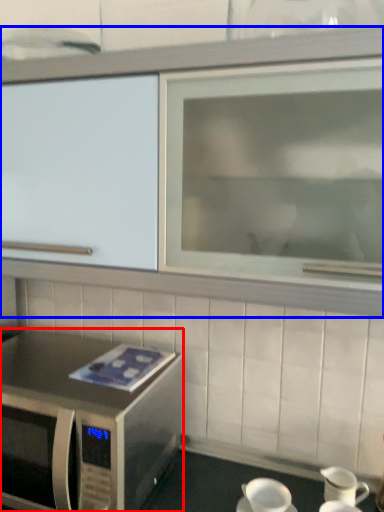
Question: Which object appears closest to the camera in this image, microwave oven (highlighted by a red box) or cabinetry (highlighted by a blue box)?

Choices:
 (A) microwave oven
 (B) cabinetry

Answer: (B)